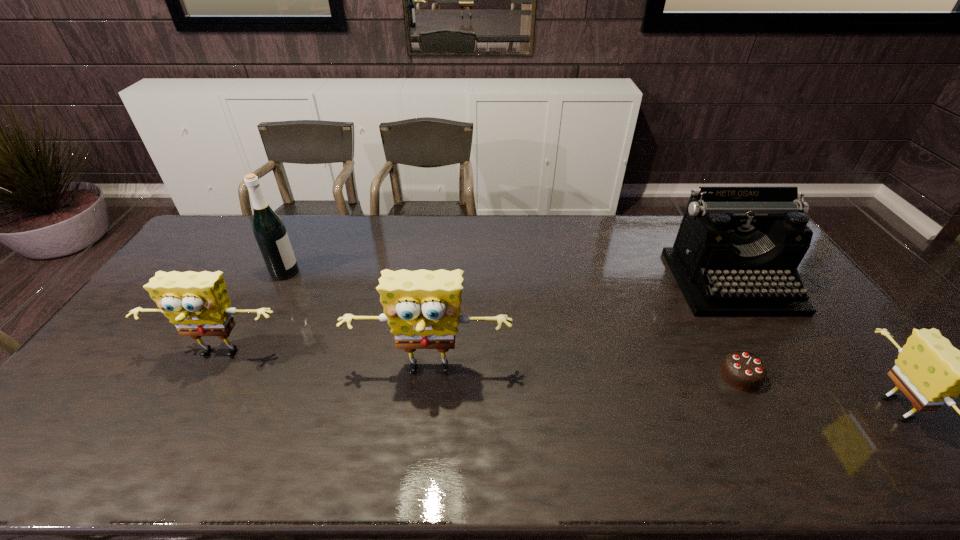
Please point a space for a new sponge to maintain equal intervals. Please provide its 2D coordinates. Your answer should be formatted as a tuple, i.e. [(x, y)], where the tuple contains the x and y coordinates of a point satisfying the conditions above.

[(656, 389)]